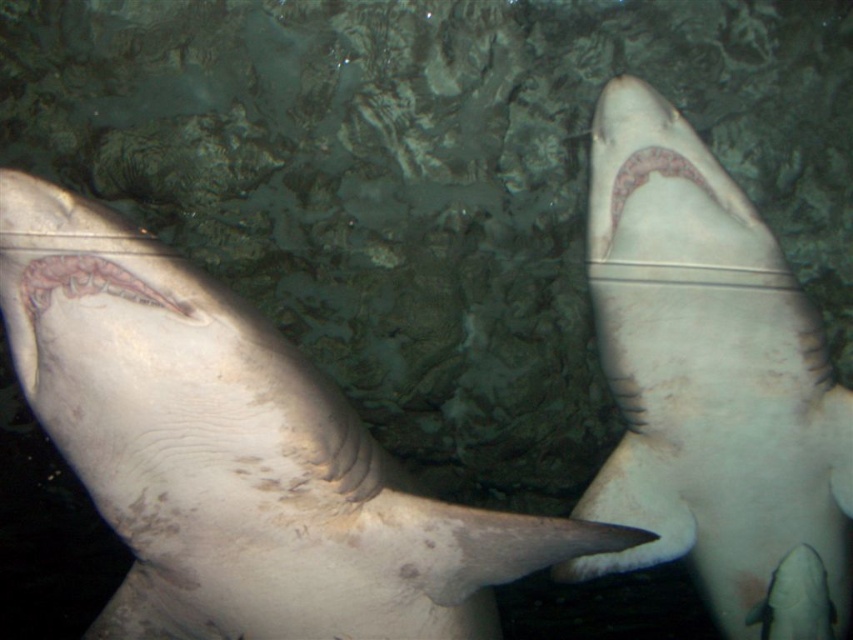
Question: Which point is farther to the camera?

Choices:
 (A) (689, 173)
 (B) (41, 314)
 (C) (798, 342)
 (D) (302, 493)

Answer: (C)

Question: Among these points, which one is farthest from the camera?

Choices:
 (A) (704, 225)
 (B) (109, 282)
 (C) (704, 184)

Answer: (A)

Question: Can you confirm if pink translucent mouth at center is positioned above pinkish-white textured gums at upper center?

Choices:
 (A) no
 (B) yes

Answer: (A)

Question: Estimate the real-world distances between objects in this image. Which object is closer to the smooth gray shark at center?

Choices:
 (A) pink translucent mouth at center
 (B) pinkish-white textured gums at upper center
 (C) smooth white shark at upper right

Answer: (A)

Question: Is the position of smooth white shark at upper right less distant than that of pinkish-white textured gums at upper center?

Choices:
 (A) yes
 (B) no

Answer: (B)

Question: Is pink translucent mouth at center bigger than pinkish-white textured gums at upper center?

Choices:
 (A) yes
 (B) no

Answer: (B)